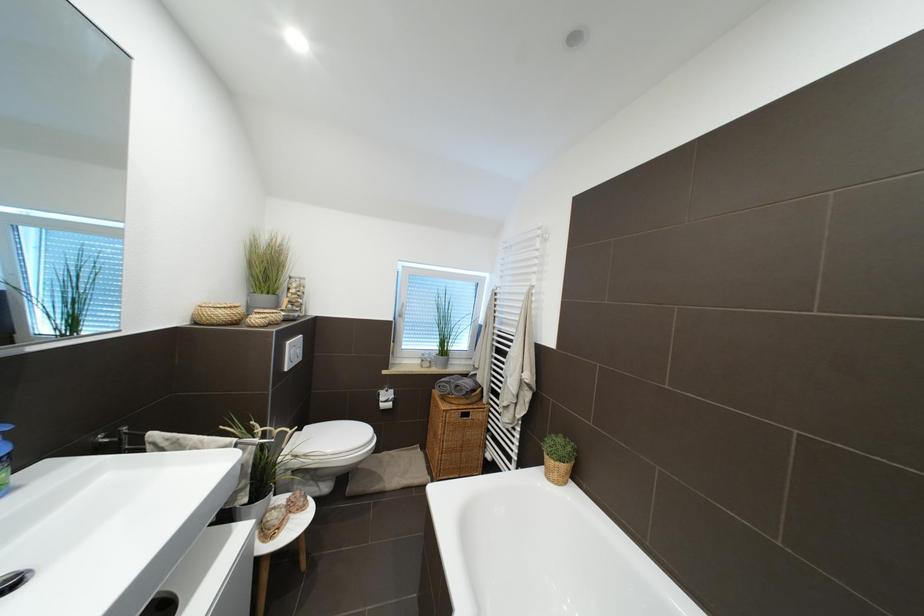
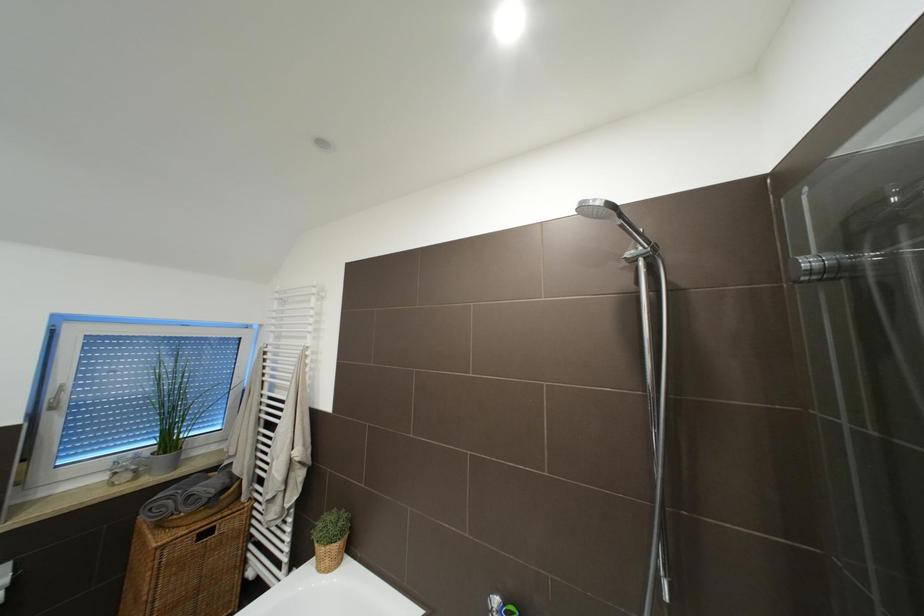
Question: The first image is from the beginning of the video and the second image is from the end. How did the camera likely rotate when shooting the video?

Choices:
 (A) Left
 (B) Right
 (C) Up
 (D) Down

Answer: (B)